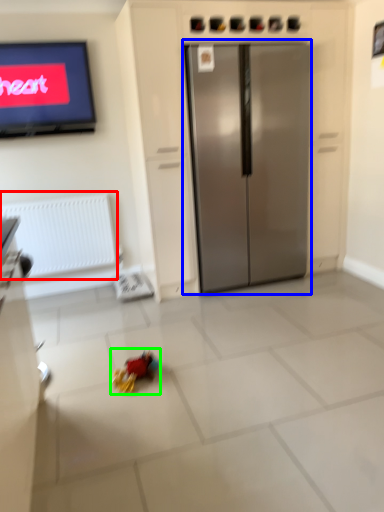
Question: Considering the real-world distances, which object is farthest from radiator (highlighted by a red box)? refrigerator (highlighted by a blue box) or miniature (highlighted by a green box)?

Choices:
 (A) refrigerator
 (B) miniature

Answer: (B)